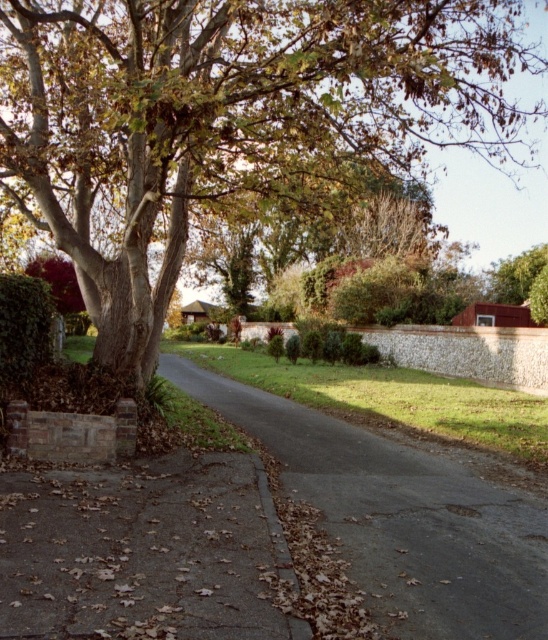
You are a delivery person trying to navigate through the suburban area shown. You need to deliver a package to a house located beyond the dark gray asphalt driveway at center. From your current position at the edge of the brown textured tree at upper left, which direction should you move to reach the driveway first?

Since the brown textured tree at upper left is located above the dark gray asphalt driveway at center, you should move downward from the brown textured tree at upper left to reach the dark gray asphalt driveway at center first.

You are a painter standing on the sidewalk across the street from the brown textured tree at upper left and dark gray asphalt driveway at center. You want to paint both objects in your painting. Which object should you focus on first if you want to capture their full height in your painting?

The brown textured tree at upper left is much taller than the dark gray asphalt driveway at center, so you should focus on painting the brown textured tree at upper left first to ensure its full height is captured before moving on to the driveway.